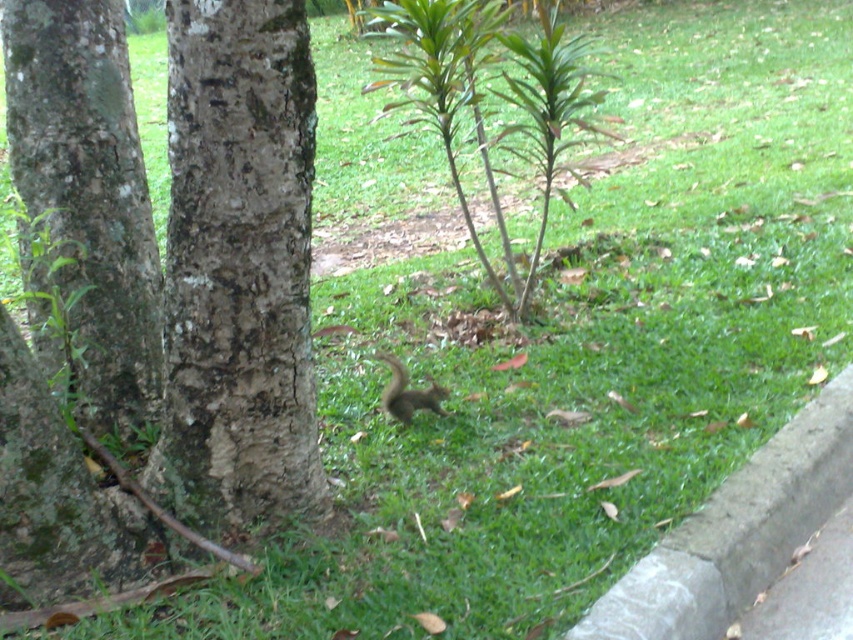
You are a gardener trying to determine if the rough bark tree at left can fit through a narrow opening in a fence that is the same width as the gray concrete curb at lower right. Can the tree fit through the opening?

The rough bark tree at left is narrower than the gray concrete curb at lower right, so it can fit through the opening.